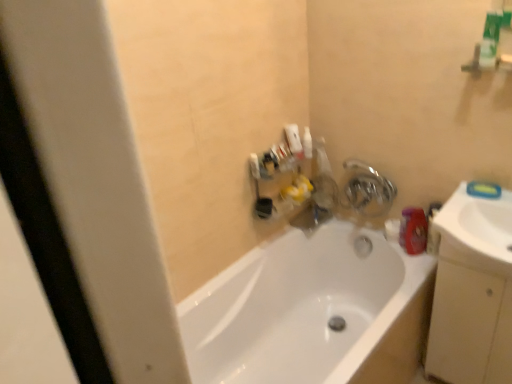
Question: Is beige matte cabinet at right in front of matte plastic faucet at upper center?

Choices:
 (A) no
 (B) yes

Answer: (B)

Question: Is beige matte cabinet at right not near matte plastic faucet at upper center?

Choices:
 (A) no
 (B) yes

Answer: (A)

Question: Is beige matte cabinet at right taller than matte plastic faucet at upper center?

Choices:
 (A) no
 (B) yes

Answer: (B)

Question: Is beige matte cabinet at right outside of matte plastic faucet at upper center?

Choices:
 (A) yes
 (B) no

Answer: (A)

Question: Can you confirm if beige matte cabinet at right is positioned to the left of matte plastic faucet at upper center?

Choices:
 (A) yes
 (B) no

Answer: (B)

Question: Can you confirm if beige matte cabinet at right is wider than matte plastic faucet at upper center?

Choices:
 (A) yes
 (B) no

Answer: (A)

Question: Does white glossy bathtub at center have a lesser width compared to white glossy sink at right?

Choices:
 (A) no
 (B) yes

Answer: (A)

Question: Is white glossy bathtub at center facing towards white glossy sink at right?

Choices:
 (A) no
 (B) yes

Answer: (A)

Question: From a real-world perspective, is white glossy bathtub at center over white glossy sink at right?

Choices:
 (A) yes
 (B) no

Answer: (B)

Question: Is white glossy bathtub at center further to the viewer compared to white glossy sink at right?

Choices:
 (A) yes
 (B) no

Answer: (B)

Question: Is white glossy bathtub at center closer to the viewer compared to white glossy sink at right?

Choices:
 (A) yes
 (B) no

Answer: (A)

Question: Can you confirm if white glossy bathtub at center is taller than white glossy sink at right?

Choices:
 (A) no
 (B) yes

Answer: (B)

Question: Is matte plastic faucet at upper center to the right of white glossy bathtub at center from the viewer's perspective?

Choices:
 (A) no
 (B) yes

Answer: (B)